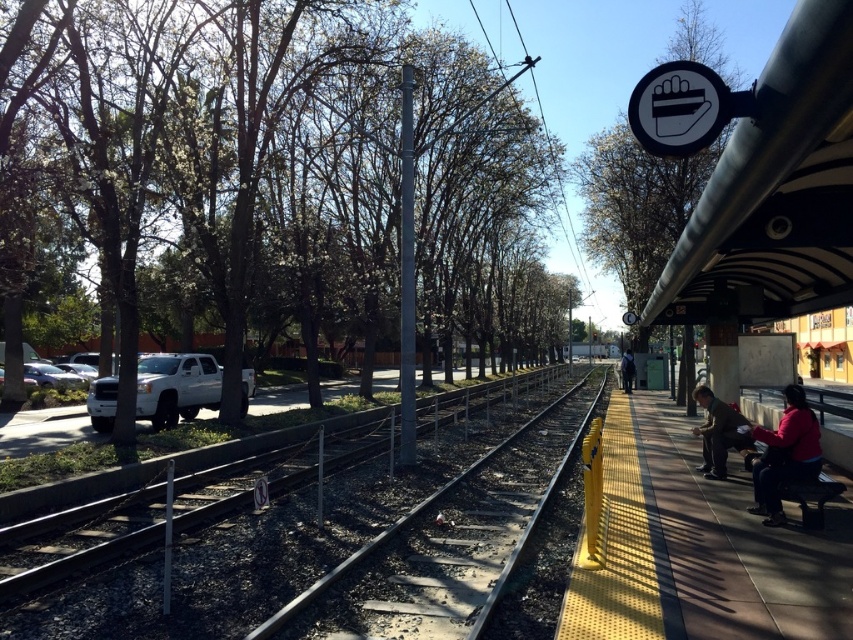
Question: Is metal train track at center bigger than dark blue jeans at right?

Choices:
 (A) no
 (B) yes

Answer: (A)

Question: Among these points, which one is nearest to the camera?

Choices:
 (A) (628, 365)
 (B) (814, 422)

Answer: (B)

Question: Which object appears closest to the camera in this image?

Choices:
 (A) dark brown leather jacket at lower right
 (B) red fabric jacket at lower right
 (C) dark blue jeans at right

Answer: (B)

Question: Is the position of dark brown leather jacket at lower right less distant than that of dark blue jeans at right?

Choices:
 (A) yes
 (B) no

Answer: (A)

Question: Does metal train track at center appear on the right side of dark brown leather jacket at lower right?

Choices:
 (A) no
 (B) yes

Answer: (A)

Question: Estimate the real-world distances between objects in this image. Which object is farther from the dark brown leather jacket at lower right?

Choices:
 (A) dark blue jeans at right
 (B) metal train track at center
 (C) red fabric jacket at lower right

Answer: (A)